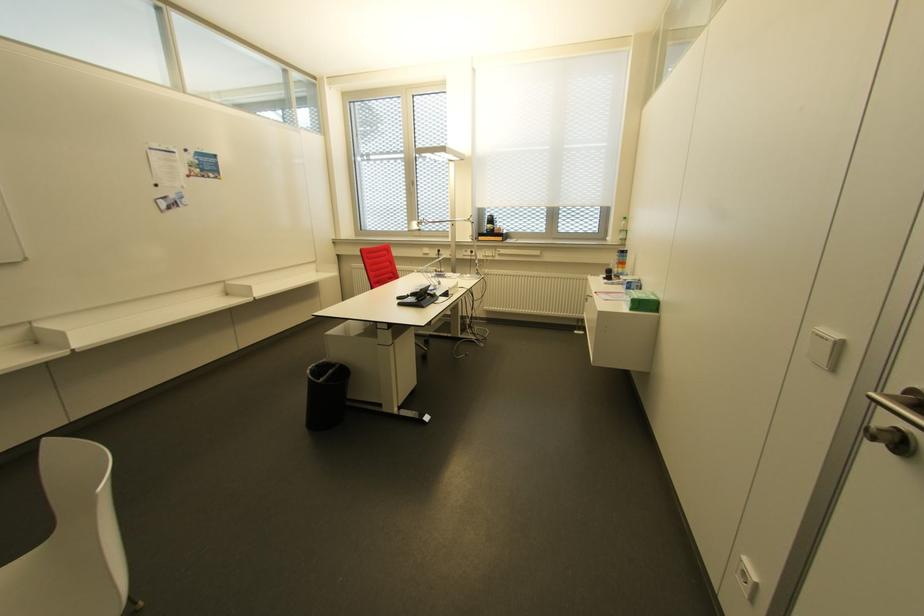
Where would you lift the green cardboard box? Please return your answer as a coordinate pair (x, y).

(642, 301)